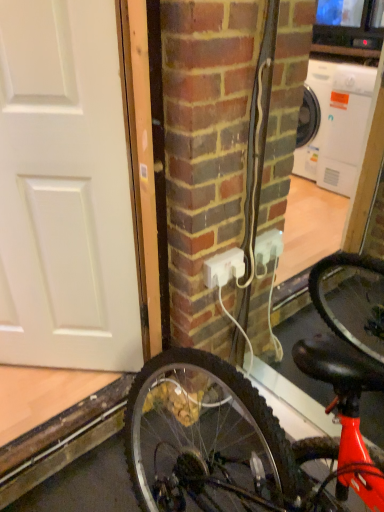
Question: Is white plastic power outlet at center in front of or behind white matte door at left in the image?

Choices:
 (A) front
 (B) behind

Answer: (B)

Question: Would you say white plastic power outlet at center is inside or outside white matte door at left?

Choices:
 (A) outside
 (B) inside

Answer: (A)

Question: From the image's perspective, relative to white matte door at left, is white plastic power outlet at center above or below?

Choices:
 (A) above
 (B) below

Answer: (B)

Question: From a real-world perspective, is white matte door at left physically located above or below white plastic power outlet at center?

Choices:
 (A) above
 (B) below

Answer: (A)

Question: From the image's perspective, is white matte door at left located above or below white plastic power outlet at center?

Choices:
 (A) above
 (B) below

Answer: (A)

Question: Based on their positions, is white matte door at left located to the left or right of white plastic power outlet at center?

Choices:
 (A) right
 (B) left

Answer: (B)

Question: Is white matte door at left bigger or smaller than white plastic power outlet at center?

Choices:
 (A) small
 (B) big

Answer: (B)